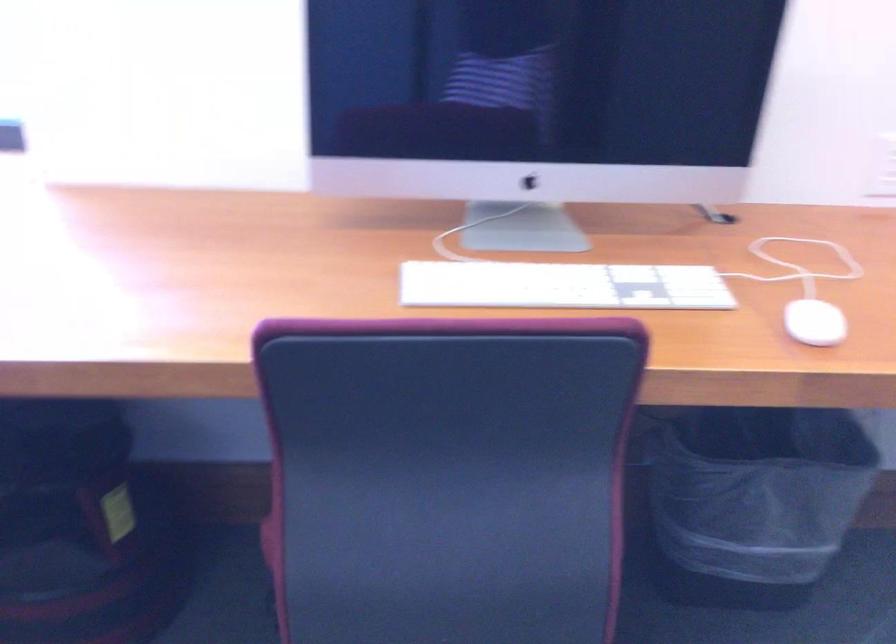
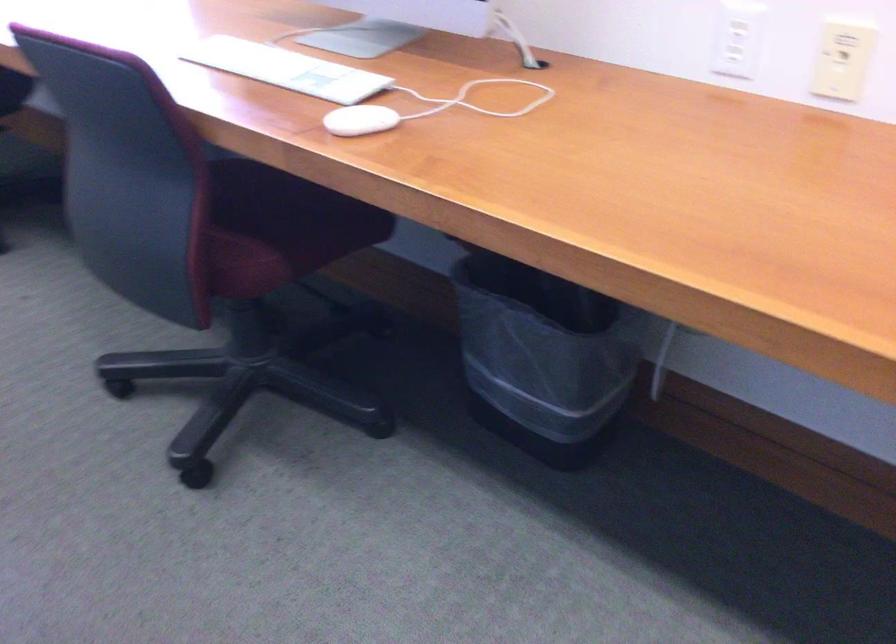
Find the pixel in the second image that matches (570,283) in the first image.

(286, 69)